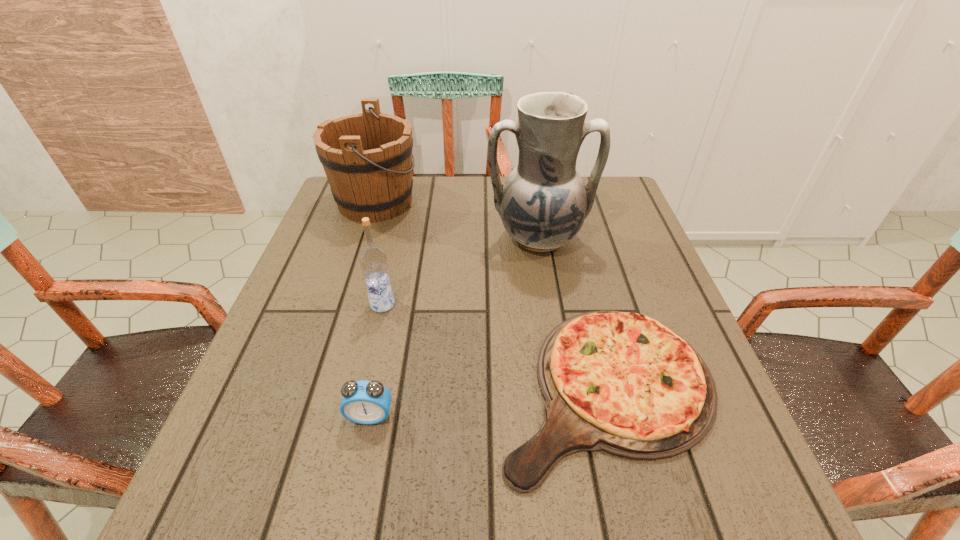
Identify the location of the tallest object. (544, 202).

Locate an element on the screen. This screenshot has width=960, height=540. wine bucket is located at coordinates (367, 158).

The height and width of the screenshot is (540, 960). I want to click on the third farthest object, so click(373, 259).

I want to click on alarm clock, so click(364, 402).

Locate an element on the screen. the shortest object is located at coordinates (623, 383).

Locate an element on the screen. The width and height of the screenshot is (960, 540). vacant space located on the front-facing side of the tallest object is located at coordinates (549, 302).

Identify the location of vacant area located on the side of the wine bucket with the handle for carrying. (451, 202).

Where is `vacant region located on the front of the vodka`? This screenshot has height=540, width=960. vacant region located on the front of the vodka is located at coordinates (370, 361).

Find the location of a particular element. Image resolution: width=960 pixels, height=540 pixels. vacant space positioned 0.050m on the face of the second shortest object is located at coordinates (362, 456).

Where is `vacant space situated on the left of the shortest object`? Image resolution: width=960 pixels, height=540 pixels. vacant space situated on the left of the shortest object is located at coordinates (407, 389).